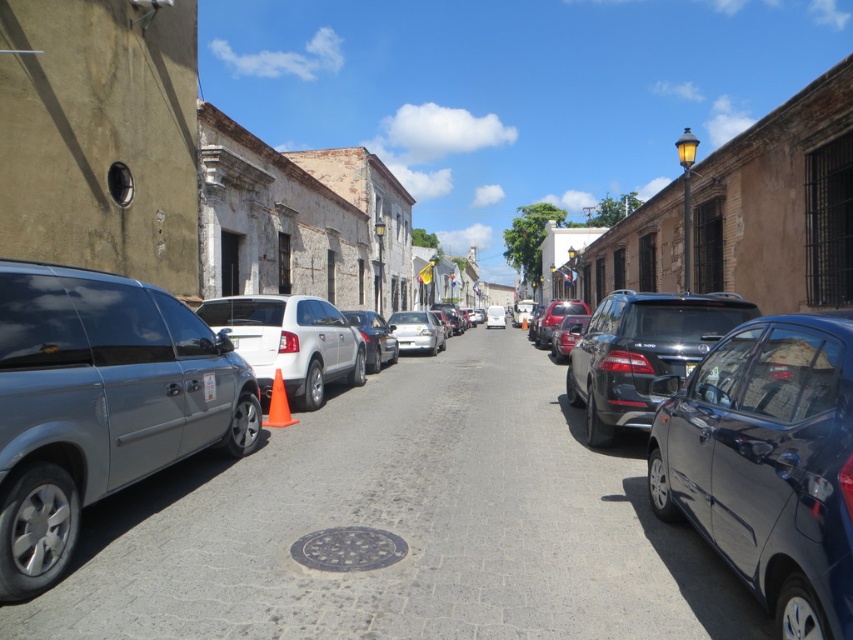
Question: Is white matte suv at center closer to the viewer compared to black plastic license plate at center?

Choices:
 (A) no
 (B) yes

Answer: (A)

Question: Which of the following is the farthest from the observer?

Choices:
 (A) glossy dark blue car at right
 (B) white matte car at center

Answer: (B)

Question: Based on their relative distances, which object is farther from the satin silver van at left?

Choices:
 (A) satin black suv at center
 (B) metallic silver van at left
 (C) white matte suv at center
 (D) satin silver sedan at center

Answer: (D)

Question: Which object appears closest to the camera in this image?

Choices:
 (A) black plastic license plate at center
 (B) satin silver van at left
 (C) glossy dark blue car at right

Answer: (C)

Question: Is metallic silver van at left below white matte car at center?

Choices:
 (A) yes
 (B) no

Answer: (A)

Question: Where is satin black suv at center located in relation to black plastic license plate at center in the image?

Choices:
 (A) right
 (B) left

Answer: (A)